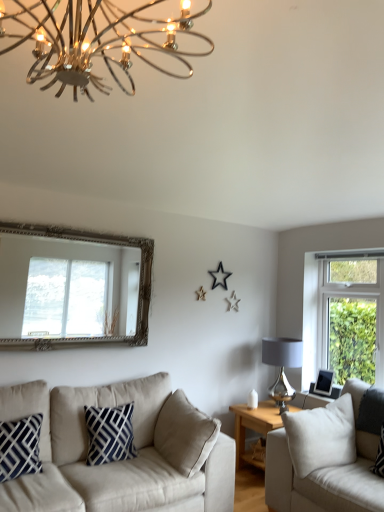
Where is `wooden side table at center`? This screenshot has width=384, height=512. wooden side table at center is located at coordinates (254, 426).

Identify the location of silver ornate mirror at upper left. The width and height of the screenshot is (384, 512). (66, 288).

Find the location of `white fabric couch at right, positioned as the 2th studio couch in left-to-right order`. white fabric couch at right, positioned as the 2th studio couch in left-to-right order is located at coordinates (324, 461).

How much space does matte gray glass lampshade at right, the first lamp when ordered from right to left, occupy vertically?

matte gray glass lampshade at right, the first lamp when ordered from right to left, is 25.51 inches in height.

Identify the location of black plastic picture frame at right. The image size is (384, 512). (324, 382).

From a real-world perspective, who is located lower, silver ornate mirror at upper left or wooden side table at center?

wooden side table at center, from a real-world perspective.

From the image's perspective, is silver ornate mirror at upper left on wooden side table at center?

Correct, silver ornate mirror at upper left appears higher than wooden side table at center in the image.

In terms of size, does silver ornate mirror at upper left appear bigger or smaller than wooden side table at center?

Considering their sizes, silver ornate mirror at upper left takes up less space than wooden side table at center.

Image resolution: width=384 pixels, height=512 pixels. I want to click on table on the right of silver ornate mirror at upper left, so click(254, 426).

Where is `table on the left of black plastic picture frame at right`? table on the left of black plastic picture frame at right is located at coordinates (254, 426).

Which is correct: wooden side table at center is inside black plastic picture frame at right, or outside of it?

wooden side table at center cannot be found inside black plastic picture frame at right.

Which of these two, wooden side table at center or black plastic picture frame at right, is bigger?

wooden side table at center.

Would you say wooden side table at center is a long distance from black plastic picture frame at right?

That's not correct — wooden side table at center is a little close to black plastic picture frame at right.

Which is in front, matte gray glass lampshade at right, marked as the second lamp in a left-to-right arrangement, or white fabric couch at right, which is counted as the first studio couch, starting from the right?

white fabric couch at right, which is counted as the first studio couch, starting from the right, is in front.

From a real-world perspective, is matte gray glass lampshade at right, which is the 2th lamp in top-to-bottom order, on white fabric couch at right, which is counted as the first studio couch, starting from the right?

Yes, from a real-world perspective, matte gray glass lampshade at right, which is the 2th lamp in top-to-bottom order, is over white fabric couch at right, which is counted as the first studio couch, starting from the right

Is point (279, 385) positioned before point (292, 501)?

No.

Is beige fabric couch at lower left, which is the 1th studio couch from left to right, facing away from silver ornate mirror at upper left?

beige fabric couch at lower left, which is the 1th studio couch from left to right, does not have its back to silver ornate mirror at upper left.

Is beige fabric couch at lower left, which is the 1th studio couch from left to right, spatially inside silver ornate mirror at upper left, or outside of it?

beige fabric couch at lower left, which is the 1th studio couch from left to right, is not enclosed by silver ornate mirror at upper left.

Is the surface of beige fabric couch at lower left, which is the 1th studio couch from left to right, in direct contact with silver ornate mirror at upper left?

There is a gap between beige fabric couch at lower left, which is the 1th studio couch from left to right, and silver ornate mirror at upper left.

From a real-world perspective, does white fabric couch at right, positioned as the 2th studio couch in left-to-right order, stand above metallic chandelier at upper center, the first lamp from the front?

No.

Would you say white fabric couch at right, positioned as the 2th studio couch in left-to-right order, is to the left or to the right of metallic chandelier at upper center, acting as the second lamp starting from the right, in the picture?

Based on their positions, white fabric couch at right, positioned as the 2th studio couch in left-to-right order, is located to the right of metallic chandelier at upper center, acting as the second lamp starting from the right.

Is white fabric couch at right, which is counted as the first studio couch, starting from the right, bigger or smaller than metallic chandelier at upper center, the second lamp positioned from the back?

Clearly, white fabric couch at right, which is counted as the first studio couch, starting from the right, is larger in size than metallic chandelier at upper center, the second lamp positioned from the back.

Which is behind, black plastic picture frame at right or matte gray glass lampshade at right, the first lamp when ordered from back to front?

Positioned behind is black plastic picture frame at right.

Choose the correct answer: Is black plastic picture frame at right inside matte gray glass lampshade at right, marked as the second lamp in a left-to-right arrangement, or outside it?

black plastic picture frame at right is located beyond the bounds of matte gray glass lampshade at right, marked as the second lamp in a left-to-right arrangement.

Which is behind, point (320, 382) or point (295, 345)?

The point (295, 345) is farther.

Is black plastic picture frame at right at the left side of matte gray glass lampshade at right, which is the 2th lamp in top-to-bottom order?

No, black plastic picture frame at right is not to the left of matte gray glass lampshade at right, which is the 2th lamp in top-to-bottom order.

Is point (352, 418) positioned before point (69, 277)?

Yes.

How far apart are white fabric couch at right, positioned as the 2th studio couch in left-to-right order, and silver ornate mirror at upper left?

white fabric couch at right, positioned as the 2th studio couch in left-to-right order, is 1.87 meters away from silver ornate mirror at upper left.

Considering the relative positions of white fabric couch at right, positioned as the 2th studio couch in left-to-right order, and silver ornate mirror at upper left in the image provided, is white fabric couch at right, positioned as the 2th studio couch in left-to-right order, to the left or to the right of silver ornate mirror at upper left?

white fabric couch at right, positioned as the 2th studio couch in left-to-right order, is positioned on silver ornate mirror at upper left's right side.

Between white fabric couch at right, positioned as the 2th studio couch in left-to-right order, and silver ornate mirror at upper left, which one has smaller width?

silver ornate mirror at upper left.

Locate an element on the screen. window above the wooden side table at center (from a real-world perspective) is located at coordinates (66, 288).

The image size is (384, 512). What are the coordinates of `table in front of the black plastic picture frame at right` in the screenshot? It's located at (254, 426).

Looking at the image, which one is located closer to beige fabric couch at lower left, which is the 1th studio couch from left to right, matte gray glass lampshade at right, marked as the second lamp in a left-to-right arrangement, or silver ornate mirror at upper left?

Based on the image, silver ornate mirror at upper left appears to be nearer to beige fabric couch at lower left, which is the 1th studio couch from left to right.

Which object lies nearer to the anchor point wooden side table at center, beige fabric couch at lower left, marked as the second studio couch in a right-to-left arrangement, or silver ornate mirror at upper left?

Among the two, beige fabric couch at lower left, marked as the second studio couch in a right-to-left arrangement, is located nearer to wooden side table at center.

Based on their spatial positions, is black plastic picture frame at right or silver ornate mirror at upper left further from matte gray glass lampshade at right, marked as the second lamp in a left-to-right arrangement?

silver ornate mirror at upper left is further to matte gray glass lampshade at right, marked as the second lamp in a left-to-right arrangement.

Which object lies nearer to the anchor point beige fabric couch at lower left, marked as the second studio couch in a right-to-left arrangement, white fabric couch at right, positioned as the 2th studio couch in left-to-right order, or black plastic picture frame at right?

Among the two, white fabric couch at right, positioned as the 2th studio couch in left-to-right order, is located nearer to beige fabric couch at lower left, marked as the second studio couch in a right-to-left arrangement.

From the image, which object appears to be farther from white fabric couch at right, positioned as the 2th studio couch in left-to-right order, beige fabric couch at lower left, which is the 1th studio couch from left to right, or metallic chandelier at upper center, the second lamp positioned from the back?

metallic chandelier at upper center, the second lamp positioned from the back, is further to white fabric couch at right, positioned as the 2th studio couch in left-to-right order.

Looking at the image, which one is located further to beige fabric couch at lower left, which is the 1th studio couch from left to right, wooden side table at center or metallic chandelier at upper center, arranged as the second lamp when ordered from the bottom?

metallic chandelier at upper center, arranged as the second lamp when ordered from the bottom, lies further to beige fabric couch at lower left, which is the 1th studio couch from left to right, than the other object.

When comparing their distances from metallic chandelier at upper center, acting as the second lamp starting from the right, does black plastic picture frame at right or white fabric couch at right, positioned as the 2th studio couch in left-to-right order, seem closer?

The object closer to metallic chandelier at upper center, acting as the second lamp starting from the right, is white fabric couch at right, positioned as the 2th studio couch in left-to-right order.

Considering their positions, is wooden side table at center positioned closer to beige fabric couch at lower left, marked as the second studio couch in a right-to-left arrangement, than silver ornate mirror at upper left?

silver ornate mirror at upper left.

This screenshot has height=512, width=384. What are the coordinates of `studio couch situated between silver ornate mirror at upper left and wooden side table at center from left to right` in the screenshot? It's located at click(110, 463).

This screenshot has height=512, width=384. Find the location of `lamp located between metallic chandelier at upper center, the first lamp from the front, and black plastic picture frame at right in the depth direction`. lamp located between metallic chandelier at upper center, the first lamp from the front, and black plastic picture frame at right in the depth direction is located at coordinates (282, 366).

In order to click on window between metallic chandelier at upper center, acting as the second lamp starting from the right, and black plastic picture frame at right, along the z-axis in this screenshot , I will do `click(66, 288)`.

Where is `table located between silver ornate mirror at upper left and white fabric couch at right, which is counted as the first studio couch, starting from the right, in the left-right direction`? table located between silver ornate mirror at upper left and white fabric couch at right, which is counted as the first studio couch, starting from the right, in the left-right direction is located at coordinates (254, 426).